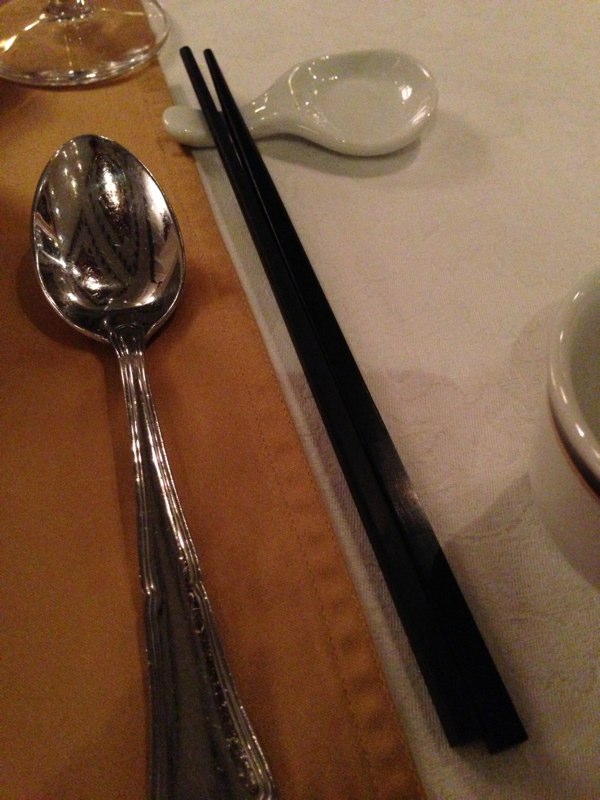
What are the coordinates of `spoon handle` in the screenshot? It's located at (195, 705).